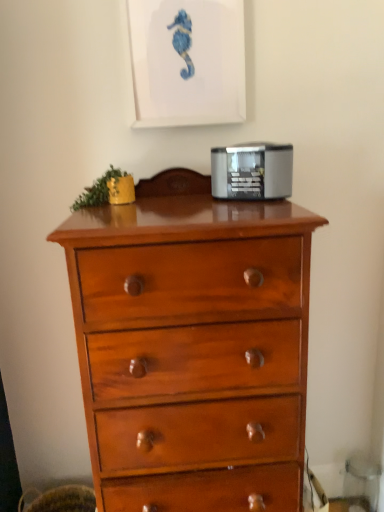
Measure the distance between satin silver toaster at upper center and camera.

A distance of 36.43 inches exists between satin silver toaster at upper center and camera.

Describe the element at coordinates (252, 170) in the screenshot. I see `satin silver toaster at upper center` at that location.

What do you see at coordinates (192, 346) in the screenshot? I see `shiny wood chest of drawers at center` at bounding box center [192, 346].

The width and height of the screenshot is (384, 512). I want to click on satin silver toaster at upper center, so click(x=252, y=170).

Is shiny wood chest of drawers at center in front of or behind matte white picture frame at upper center in the image?

shiny wood chest of drawers at center is positioned closer to the viewer than matte white picture frame at upper center.

Is shiny wood chest of drawers at center completely or partially outside of matte white picture frame at upper center?

Absolutely, shiny wood chest of drawers at center is external to matte white picture frame at upper center.

The width and height of the screenshot is (384, 512). I want to click on picture frame that is above the shiny wood chest of drawers at center (from a real-world perspective), so click(x=187, y=61).

In the scene shown: Considering the sizes of objects shiny wood chest of drawers at center and matte white picture frame at upper center in the image provided, who is thinner, shiny wood chest of drawers at center or matte white picture frame at upper center?

Thinner between the two is matte white picture frame at upper center.

Looking at their sizes, would you say satin silver toaster at upper center is wider or thinner than matte white picture frame at upper center?

In the image, satin silver toaster at upper center appears to be wider than matte white picture frame at upper center.

Looking at this image, from the image's perspective, which object appears higher, satin silver toaster at upper center or matte white picture frame at upper center?

From the image's view, matte white picture frame at upper center is above.

Can you confirm if satin silver toaster at upper center is positioned to the left of matte white picture frame at upper center?

In fact, satin silver toaster at upper center is to the right of matte white picture frame at upper center.

Considering the positions of point (212, 161) and point (172, 78), is point (212, 161) closer or farther from the camera than point (172, 78)?

Clearly, point (212, 161) is more distant from the camera than point (172, 78).

Is shiny wood chest of drawers at center touching satin silver toaster at upper center?

No.

Does shiny wood chest of drawers at center have a greater width compared to satin silver toaster at upper center?

Correct, the width of shiny wood chest of drawers at center exceeds that of satin silver toaster at upper center.

Is shiny wood chest of drawers at center turned away from satin silver toaster at upper center?

shiny wood chest of drawers at center is not turned away from satin silver toaster at upper center.

How different are the orientations of shiny wood chest of drawers at center and satin silver toaster at upper center in degrees?

The angular difference between shiny wood chest of drawers at center and satin silver toaster at upper center is 27.8 degrees.

Is satin silver toaster at upper center outside of shiny wood chest of drawers at center?

Actually, satin silver toaster at upper center is at least partially inside shiny wood chest of drawers at center.

From the image's perspective, which is above, satin silver toaster at upper center or shiny wood chest of drawers at center?

satin silver toaster at upper center.

How many degrees apart are the facing directions of satin silver toaster at upper center and shiny wood chest of drawers at center?

They differ by 27.8 degrees in their facing directions.

Between satin silver toaster at upper center and shiny wood chest of drawers at center, which one is positioned in front?

shiny wood chest of drawers at center is in front.

Who is bigger, matte white picture frame at upper center or satin silver toaster at upper center?

With larger size is matte white picture frame at upper center.

Find the location of `appliance directly beneath the matte white picture frame at upper center (from a real-world perspective)`. appliance directly beneath the matte white picture frame at upper center (from a real-world perspective) is located at coordinates (252, 170).

Is matte white picture frame at upper center situated inside satin silver toaster at upper center or outside?

matte white picture frame at upper center exists outside the volume of satin silver toaster at upper center.

From a real-world perspective, between matte white picture frame at upper center and satin silver toaster at upper center, who is vertically higher?

matte white picture frame at upper center.

Considering the relative positions of matte white picture frame at upper center and shiny wood chest of drawers at center in the image provided, is matte white picture frame at upper center to the left of shiny wood chest of drawers at center from the viewer's perspective?

Yes.

Is matte white picture frame at upper center aimed at shiny wood chest of drawers at center?

No, matte white picture frame at upper center is not turned towards shiny wood chest of drawers at center.

From a real-world perspective, which object rests below the other?

shiny wood chest of drawers at center, from a real-world perspective.

The image size is (384, 512). What are the coordinates of `chest of drawers on the right of matte white picture frame at upper center` in the screenshot? It's located at (192, 346).

This screenshot has width=384, height=512. Identify the location of picture frame that is on the left side of satin silver toaster at upper center. pyautogui.click(x=187, y=61).

Looking at the image, which one is located closer to shiny wood chest of drawers at center, matte white picture frame at upper center or satin silver toaster at upper center?

The object closer to shiny wood chest of drawers at center is satin silver toaster at upper center.

Considering their positions, is shiny wood chest of drawers at center positioned further to satin silver toaster at upper center than matte white picture frame at upper center?

shiny wood chest of drawers at center is further to satin silver toaster at upper center.

When comparing their distances from matte white picture frame at upper center, does shiny wood chest of drawers at center or satin silver toaster at upper center seem closer?

satin silver toaster at upper center lies closer to matte white picture frame at upper center than the other object.

Based on their spatial positions, is satin silver toaster at upper center or matte white picture frame at upper center closer to shiny wood chest of drawers at center?

satin silver toaster at upper center is closer to shiny wood chest of drawers at center.

Estimate the real-world distances between objects in this image. Which object is closer to satin silver toaster at upper center, matte white picture frame at upper center or shiny wood chest of drawers at center?

The object closer to satin silver toaster at upper center is matte white picture frame at upper center.

Based on their spatial positions, is satin silver toaster at upper center or shiny wood chest of drawers at center further from matte white picture frame at upper center?

Based on the image, shiny wood chest of drawers at center appears to be further to matte white picture frame at upper center.

The image size is (384, 512). Identify the location of appliance between matte white picture frame at upper center and shiny wood chest of drawers at center vertically. (252, 170).